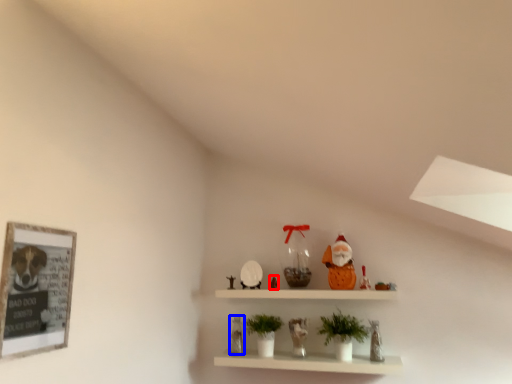
Question: Which object is further to the camera taking this photo, toy (highlighted by a red box) or toy (highlighted by a blue box)?

Choices:
 (A) toy
 (B) toy

Answer: (A)